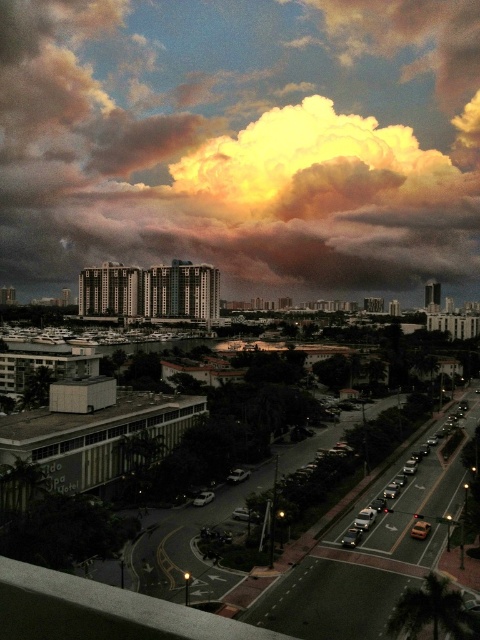
Is golden textured cloud at upper center closer to camera compared to green leafy palm tree at lower right?

That is False.

The height and width of the screenshot is (640, 480). I want to click on golden textured cloud at upper center, so click(242, 141).